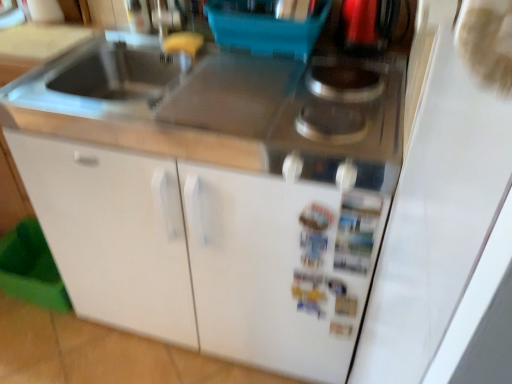
This screenshot has height=384, width=512. Find the location of `white matte cabinet at center, marked as the 2th cabinetry in a left-to-right arrangement`. white matte cabinet at center, marked as the 2th cabinetry in a left-to-right arrangement is located at coordinates (204, 253).

This screenshot has height=384, width=512. What do you see at coordinates (204, 253) in the screenshot? I see `white matte cabinet at center, which is the 1th cabinetry in right-to-left order` at bounding box center [204, 253].

What do you see at coordinates (343, 120) in the screenshot? This screenshot has height=384, width=512. I see `metallic silver gas stove at upper right` at bounding box center [343, 120].

This screenshot has height=384, width=512. Identify the location of white matte cabinet at lower left, acting as the 1th cabinetry starting from the left. (113, 234).

Between white matte cabinet at lower left, acting as the 1th cabinetry starting from the left, and metallic silver gas stove at upper right, which one has larger size?

white matte cabinet at lower left, acting as the 1th cabinetry starting from the left, is bigger.

From a real-world perspective, who is located higher, white matte cabinet at lower left, acting as the 1th cabinetry starting from the left, or metallic silver gas stove at upper right?

metallic silver gas stove at upper right.

Considering their positions, is white matte cabinet at lower left, acting as the 1th cabinetry starting from the left, located in front of or behind metallic silver gas stove at upper right?

Visually, white matte cabinet at lower left, acting as the 1th cabinetry starting from the left, is located in front of metallic silver gas stove at upper right.

Find the location of a particular element. Image resolution: width=512 pixels, height=384 pixels. cabinetry that is under the white matte cabinet at lower left, which ranks as the 2th cabinetry in right-to-left order (from a real-world perspective) is located at coordinates (204, 253).

What's the angular difference between white matte cabinet at lower left, which ranks as the 2th cabinetry in right-to-left order, and white matte cabinet at center, which is the 1th cabinetry in right-to-left order,'s facing directions?

The angular difference between white matte cabinet at lower left, which ranks as the 2th cabinetry in right-to-left order, and white matte cabinet at center, which is the 1th cabinetry in right-to-left order, is 1.2 degrees.

Consider the image. Does white matte cabinet at lower left, which ranks as the 2th cabinetry in right-to-left order, have a lesser width compared to white matte cabinet at center, marked as the 2th cabinetry in a left-to-right arrangement?

In fact, white matte cabinet at lower left, which ranks as the 2th cabinetry in right-to-left order, might be wider than white matte cabinet at center, marked as the 2th cabinetry in a left-to-right arrangement.

Is white matte cabinet at lower left, which ranks as the 2th cabinetry in right-to-left order, surrounding white matte cabinet at center, marked as the 2th cabinetry in a left-to-right arrangement?

No.

What are the coordinates of `cabinetry on the left of the white matte cabinet at center, which is the 1th cabinetry in right-to-left order` in the screenshot? It's located at (x=113, y=234).

Considering the positions of objects white matte cabinet at center, which is the 1th cabinetry in right-to-left order, and white matte cabinet at lower left, which ranks as the 2th cabinetry in right-to-left order, in the image provided, who is more to the right, white matte cabinet at center, which is the 1th cabinetry in right-to-left order, or white matte cabinet at lower left, which ranks as the 2th cabinetry in right-to-left order,?

white matte cabinet at center, which is the 1th cabinetry in right-to-left order.

From the picture: Who is more distant, white matte cabinet at center, marked as the 2th cabinetry in a left-to-right arrangement, or white matte cabinet at lower left, which ranks as the 2th cabinetry in right-to-left order?

white matte cabinet at center, marked as the 2th cabinetry in a left-to-right arrangement, is further from the camera.

Would you say white matte cabinet at center, marked as the 2th cabinetry in a left-to-right arrangement, is inside or outside white matte cabinet at lower left, which ranks as the 2th cabinetry in right-to-left order?

white matte cabinet at center, marked as the 2th cabinetry in a left-to-right arrangement, cannot be found inside white matte cabinet at lower left, which ranks as the 2th cabinetry in right-to-left order.

From the image's perspective, does white matte cabinet at center, marked as the 2th cabinetry in a left-to-right arrangement, appear lower than metallic silver gas stove at upper right?

Correct, white matte cabinet at center, marked as the 2th cabinetry in a left-to-right arrangement, appears lower than metallic silver gas stove at upper right in the image.

Would you say white matte cabinet at center, which is the 1th cabinetry in right-to-left order, is to the left or to the right of metallic silver gas stove at upper right in the picture?

white matte cabinet at center, which is the 1th cabinetry in right-to-left order, is positioned on metallic silver gas stove at upper right's left side.

Identify the location of gas stove above the white matte cabinet at center, marked as the 2th cabinetry in a left-to-right arrangement (from a real-world perspective). This screenshot has width=512, height=384. (343, 120).

Is white matte cabinet at center, marked as the 2th cabinetry in a left-to-right arrangement, placed right next to metallic silver gas stove at upper right?

They are not placed beside each other.

You are a GUI agent. You are given a task and a screenshot of the screen. Output one action in this format:
    pyautogui.click(x=<x>, y=<y>)
    Task: Click on the 2nd cabinetry below when counting from the metallic silver gas stove at upper right (from the image's perspective)
    
    Given the screenshot: What is the action you would take?
    pyautogui.click(x=204, y=253)

Consider the image. Is metallic silver gas stove at upper right to the right of white matte cabinet at center, which is the 1th cabinetry in right-to-left order, from the viewer's perspective?

Correct, you'll find metallic silver gas stove at upper right to the right of white matte cabinet at center, which is the 1th cabinetry in right-to-left order.

Which is behind, metallic silver gas stove at upper right or white matte cabinet at center, which is the 1th cabinetry in right-to-left order?

Positioned behind is white matte cabinet at center, which is the 1th cabinetry in right-to-left order.

Locate an element on the screen. The width and height of the screenshot is (512, 384). gas stove on the right of white matte cabinet at lower left, which ranks as the 2th cabinetry in right-to-left order is located at coordinates (343, 120).

From the image's perspective, which is below, metallic silver gas stove at upper right or white matte cabinet at lower left, which ranks as the 2th cabinetry in right-to-left order?

white matte cabinet at lower left, which ranks as the 2th cabinetry in right-to-left order, appears lower in the image.

Can you confirm if metallic silver gas stove at upper right is wider than white matte cabinet at lower left, which ranks as the 2th cabinetry in right-to-left order?

In fact, metallic silver gas stove at upper right might be narrower than white matte cabinet at lower left, which ranks as the 2th cabinetry in right-to-left order.

From the picture: From a real-world perspective, is metallic silver gas stove at upper right over white matte cabinet at lower left, which ranks as the 2th cabinetry in right-to-left order?

Yes, from a real-world perspective, metallic silver gas stove at upper right is over white matte cabinet at lower left, which ranks as the 2th cabinetry in right-to-left order

Image resolution: width=512 pixels, height=384 pixels. In order to click on cabinetry in front of the metallic silver gas stove at upper right in this screenshot , I will do `click(113, 234)`.

The width and height of the screenshot is (512, 384). In order to click on cabinetry that is above the white matte cabinet at center, which is the 1th cabinetry in right-to-left order (from the image's perspective) in this screenshot , I will do `click(113, 234)`.

Based on their spatial positions, is white matte cabinet at center, which is the 1th cabinetry in right-to-left order, or metallic silver gas stove at upper right further from white matte cabinet at lower left, acting as the 1th cabinetry starting from the left?

metallic silver gas stove at upper right is positioned further to the anchor white matte cabinet at lower left, acting as the 1th cabinetry starting from the left.

Which object lies further to the anchor point white matte cabinet at lower left, which ranks as the 2th cabinetry in right-to-left order, metallic silver gas stove at upper right or white matte cabinet at center, which is the 1th cabinetry in right-to-left order?

metallic silver gas stove at upper right is positioned further to the anchor white matte cabinet at lower left, which ranks as the 2th cabinetry in right-to-left order.

Considering their positions, is white matte cabinet at lower left, which ranks as the 2th cabinetry in right-to-left order, positioned further to metallic silver gas stove at upper right than white matte cabinet at center, which is the 1th cabinetry in right-to-left order?

Among the two, white matte cabinet at lower left, which ranks as the 2th cabinetry in right-to-left order, is located further to metallic silver gas stove at upper right.

Based on their spatial positions, is metallic silver gas stove at upper right or white matte cabinet at lower left, which ranks as the 2th cabinetry in right-to-left order, closer to white matte cabinet at center, marked as the 2th cabinetry in a left-to-right arrangement?

The object closer to white matte cabinet at center, marked as the 2th cabinetry in a left-to-right arrangement, is white matte cabinet at lower left, which ranks as the 2th cabinetry in right-to-left order.

Which object lies further to the anchor point white matte cabinet at center, marked as the 2th cabinetry in a left-to-right arrangement, white matte cabinet at lower left, acting as the 1th cabinetry starting from the left, or metallic silver gas stove at upper right?

metallic silver gas stove at upper right lies further to white matte cabinet at center, marked as the 2th cabinetry in a left-to-right arrangement, than the other object.

Estimate the real-world distances between objects in this image. Which object is closer to metallic silver gas stove at upper right, white matte cabinet at center, marked as the 2th cabinetry in a left-to-right arrangement, or white matte cabinet at lower left, acting as the 1th cabinetry starting from the left?

white matte cabinet at center, marked as the 2th cabinetry in a left-to-right arrangement.

Where is `cabinetry between white matte cabinet at lower left, acting as the 1th cabinetry starting from the left, and metallic silver gas stove at upper right`? Image resolution: width=512 pixels, height=384 pixels. cabinetry between white matte cabinet at lower left, acting as the 1th cabinetry starting from the left, and metallic silver gas stove at upper right is located at coordinates (204, 253).